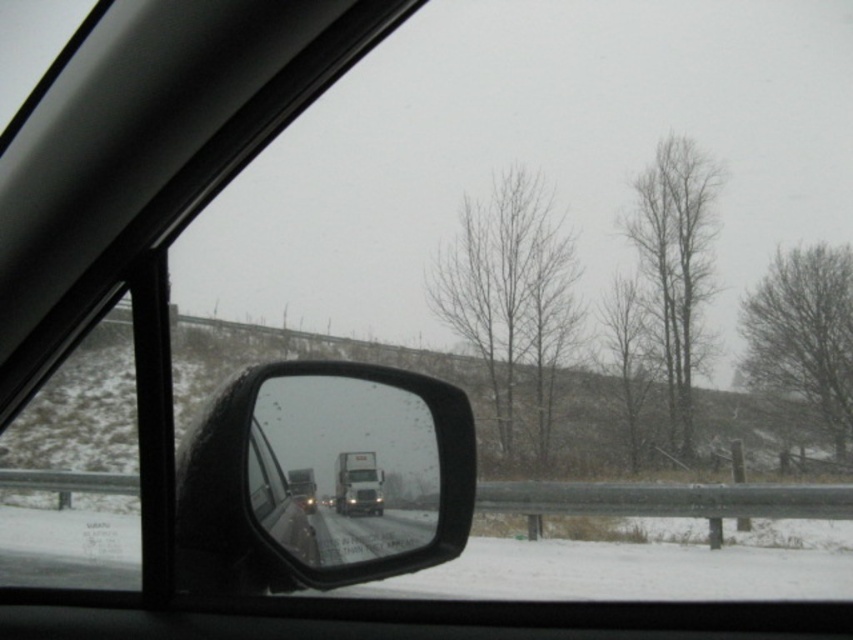
Question: Which point is closer to the camera?

Choices:
 (A) white glossy trailer truck at center
 (B) black glossy rearview mirror at center

Answer: (B)

Question: Is black glossy rearview mirror at center positioned at the back of white glossy trailer truck at center?

Choices:
 (A) no
 (B) yes

Answer: (A)

Question: Is black glossy rearview mirror at center thinner than white glossy trailer truck at center?

Choices:
 (A) no
 (B) yes

Answer: (A)

Question: Is the position of black glossy rearview mirror at center more distant than that of white glossy trailer truck at center?

Choices:
 (A) yes
 (B) no

Answer: (B)